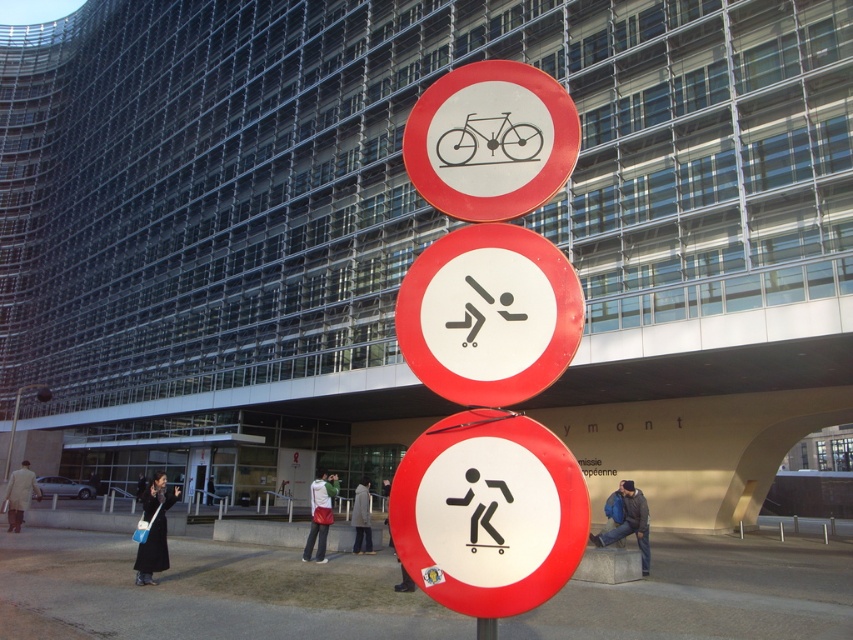
Looking at this image, you are an artist who wants to hang a new sculpture between the white paper figure at center and the metallic pole at center. The sculpture requires at least 1.2 meters of vertical space. Based on the scene, can you determine if there is enough space between them?

The white paper figure at center has a greater height compared to the metallic pole at center. Therefore, the vertical space between them may vary depending on their exact positions. However, since the sculpture requires at least 1.2 meters of vertical space, it is recommended to measure the actual distance before installing the sculpture to ensure it fits properly.

You are standing at the base of the curved glass building and want to hand a document to someone wearing the white cotton jacket at center. If you can only throw the document 20 feet, will you be able to reach them from your current position near the dark blue jacket at lower right?

The dark blue jacket at lower right is 24.18 feet away from the white cotton jacket at center. Since you can only throw 20 feet, you cannot reach them from your current position.

You are a pedestrian standing in front of the building and see the dark blue jacket at lower right and the white cotton jacket at center. Which jacket takes up more area in the image?

The white cotton jacket at center occupies more space than the dark blue jacket at lower right.